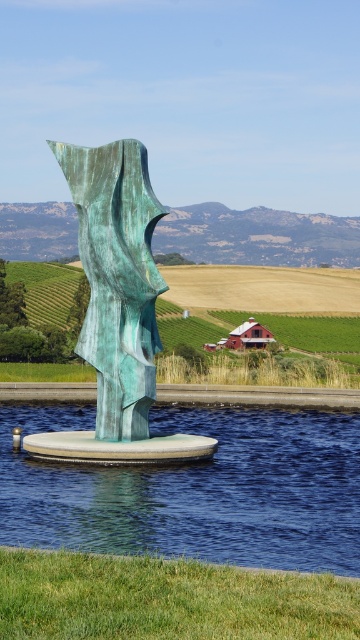
You are an artist planning to photograph the green patina sculpture at center and the green grassy field at center from a distance. Which object will appear smaller in the photo?

The green patina sculpture at center will appear smaller in the photo because it has a lesser height compared to the green grassy field at center.

You are standing in front of the sculpture and want to know the exact position of the clear blue water at center. Can you determine its coordinates?

The clear blue water at center is located at point (195,490).

From the picture: You are an architect designing a new park layout. You need to place a new bench exactly 1 meter north of the green patina sculpture at center. Given the coordinates of the sculpture, can you determine the coordinates of where the bench should be placed?

The coordinates of the green patina sculpture at center are given as point (x=117, y=308). To place the bench 1 meter north, you would add 1 meter to the y coordinate, resulting in new coordinates of (x=359, y=308).